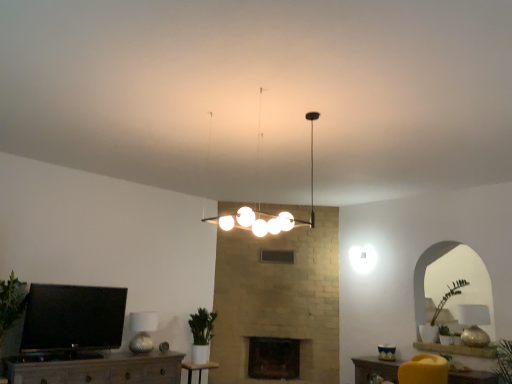
Find the location of `matte wood tv stand at lower left, positioned as the 1th furniture in left-to-right order`. matte wood tv stand at lower left, positioned as the 1th furniture in left-to-right order is located at coordinates (97, 368).

Find the location of a particular element. Image resolution: width=512 pixels, height=384 pixels. matte black tv at left is located at coordinates (72, 318).

Where is `metallic textured lampshade at lower left, acting as the 1th lamp starting from the left`? metallic textured lampshade at lower left, acting as the 1th lamp starting from the left is located at coordinates (142, 331).

What is the approximate height of velvet yellow armchair at lower right, which is the second furniture from left to right?

It is 15.23 inches.

Image resolution: width=512 pixels, height=384 pixels. What do you see at coordinates (474, 324) in the screenshot?
I see `gold textured lampshade at right, the second lamp when ordered from front to back` at bounding box center [474, 324].

Identify the location of wooden table at center, the first table from the left. (198, 369).

Where is `dark stone fireplace at center`? dark stone fireplace at center is located at coordinates (274, 358).

Which is in front, matte black tv at left or velvet yellow armchair at lower right, which appears as the first furniture when viewed from the right?

matte black tv at left is more forward.

Considering the sizes of objects matte black tv at left and velvet yellow armchair at lower right, which appears as the first furniture when viewed from the right, in the image provided, who is bigger, matte black tv at left or velvet yellow armchair at lower right, which appears as the first furniture when viewed from the right,?

velvet yellow armchair at lower right, which appears as the first furniture when viewed from the right, is bigger.

Is matte black tv at left oriented away from velvet yellow armchair at lower right, which appears as the first furniture when viewed from the right?

matte black tv at left is not turned away from velvet yellow armchair at lower right, which appears as the first furniture when viewed from the right.

What are the coordinates of `television above the velvet yellow armchair at lower right, which is the second furniture from left to right (from the image's perspective)` in the screenshot? It's located at (72, 318).

Which is less distant, [254,377] or [376,371]?

Point [254,377] is positioned farther from the camera compared to point [376,371].

Does dark stone fireplace at center have a greater width compared to matte wood table at lower center, which appears as the 1th table when viewed from the top?

Indeed, dark stone fireplace at center has a greater width compared to matte wood table at lower center, which appears as the 1th table when viewed from the top.

What's the angular difference between dark stone fireplace at center and matte wood table at lower center, which ranks as the second table in back-to-front order,'s facing directions?

The angle between the facing direction of dark stone fireplace at center and the facing direction of matte wood table at lower center, which ranks as the second table in back-to-front order, is 63.2 degrees.

From a real-world perspective, is dark stone fireplace at center physically below matte wood table at lower center, which is the 1th table from front to back?

Yes, from a real-world perspective, dark stone fireplace at center is beneath matte wood table at lower center, which is the 1th table from front to back.

Which of these two, velvet yellow armchair at lower right, which is the second furniture from left to right, or white glossy light fixture at center, the 1th lamp from the top, is wider?

white glossy light fixture at center, the 1th lamp from the top, is wider.

Is velvet yellow armchair at lower right, which is the second furniture from left to right, in front of or behind white glossy light fixture at center, the 1th lamp from the top, in the image?

Clearly, velvet yellow armchair at lower right, which is the second furniture from left to right, is behind white glossy light fixture at center, the 1th lamp from the top.

Is point (391, 366) positioned in front of point (259, 150)?

No, (391, 366) is behind (259, 150).

Looking at the image, does green matte plant at center seem bigger or smaller compared to matte wood table at lower center, the 2th table when ordered from left to right?

In the image, green matte plant at center appears to be larger than matte wood table at lower center, the 2th table when ordered from left to right.

Based on the photo, considering the sizes of objects green matte plant at center and matte wood table at lower center, the 2th table when ordered from left to right, in the image provided, who is shorter, green matte plant at center or matte wood table at lower center, the 2th table when ordered from left to right,?

Standing shorter between the two is matte wood table at lower center, the 2th table when ordered from left to right.

Is green matte plant at center placed right next to matte wood table at lower center, which appears as the 1th table when viewed from the top?

No.

Does green matte plant at center have a greater width compared to matte wood table at lower center, which is the 1th table from front to back?

Yes.

Is metallic textured lampshade at lower left, arranged as the third lamp when viewed from the front, inside velvet yellow armchair at lower right, which is the second furniture from left to right?

No, velvet yellow armchair at lower right, which is the second furniture from left to right, does not contain metallic textured lampshade at lower left, arranged as the third lamp when viewed from the front.

From the image's perspective, is velvet yellow armchair at lower right, which is the second furniture from left to right, above or below metallic textured lampshade at lower left, which is the 1th lamp in bottom-to-top order?

velvet yellow armchair at lower right, which is the second furniture from left to right, is situated lower than metallic textured lampshade at lower left, which is the 1th lamp in bottom-to-top order, in the image.

Considering the points (448, 381) and (143, 320), which point is behind, point (448, 381) or point (143, 320)?

Positioned behind is point (143, 320).

The height and width of the screenshot is (384, 512). I want to click on the 1st furniture in front of the metallic textured lampshade at lower left, the third lamp when ordered from right to left, so click(375, 369).

Which of these two, green matte plant at center or gold textured lampshade at right, the second lamp when ordered from front to back, is bigger?

green matte plant at center.

Based on the photo, considering the sizes of green matte plant at center and gold textured lampshade at right, marked as the 2th lamp in a top-to-bottom arrangement, in the image, is green matte plant at center wider or thinner than gold textured lampshade at right, marked as the 2th lamp in a top-to-bottom arrangement,?

Clearly, green matte plant at center has more width compared to gold textured lampshade at right, marked as the 2th lamp in a top-to-bottom arrangement.

How many degrees apart are the facing directions of green matte plant at center and gold textured lampshade at right, which appears as the 1th lamp when viewed from the right?

The facing directions of green matte plant at center and gold textured lampshade at right, which appears as the 1th lamp when viewed from the right, are 1.04 degrees apart.

Is gold textured lampshade at right, which appears as the second lamp when ordered from the bottom, completely or partially inside green matte plant at center?

No, green matte plant at center does not contain gold textured lampshade at right, which appears as the second lamp when ordered from the bottom.

Is matte black tv at left turned away from matte wood table at lower center, which appears as the 1th table when viewed from the top?

No.

Considering the relative sizes of matte black tv at left and matte wood table at lower center, which ranks as the second table in back-to-front order, in the image provided, is matte black tv at left smaller than matte wood table at lower center, which ranks as the second table in back-to-front order,?

Actually, matte black tv at left might be larger than matte wood table at lower center, which ranks as the second table in back-to-front order.

Which is further, (100, 302) or (396, 377)?

The point (396, 377) is more distant.

Considering the relative sizes of matte black tv at left and matte wood table at lower center, the 2th table when ordered from left to right, in the image provided, is matte black tv at left shorter than matte wood table at lower center, the 2th table when ordered from left to right,?

Incorrect, the height of matte black tv at left does not fall short of that of matte wood table at lower center, the 2th table when ordered from left to right.

You are a GUI agent. You are given a task and a screenshot of the screen. Output one action in this format:
    pyautogui.click(x=<x>, y=<y>)
    Task: Click on the furniture behind the matte black tv at left
    
    Given the screenshot: What is the action you would take?
    pyautogui.click(x=375, y=369)

Identify the location of fireplace that is on the left side of matte wood table at lower center, which appears as the 1th table when viewed from the top. (274, 358).

Which object lies further to the anchor point matte wood table at lower center, placed as the second table when sorted from bottom to top, green matte plant at center or matte wood tv stand at lower left, positioned as the 1th furniture in left-to-right order?

matte wood tv stand at lower left, positioned as the 1th furniture in left-to-right order.

Considering their positions, is green matte plant at center positioned closer to matte wood tv stand at lower left, positioned as the 1th furniture in left-to-right order, than white glossy light fixture at center, the 1th lamp from the top?

Among the two, green matte plant at center is located nearer to matte wood tv stand at lower left, positioned as the 1th furniture in left-to-right order.

Considering their positions, is matte black tv at left positioned closer to velvet yellow armchair at lower right, which is the second furniture from left to right, than gold textured lampshade at right, which appears as the second lamp when ordered from the bottom?

gold textured lampshade at right, which appears as the second lamp when ordered from the bottom.

Estimate the real-world distances between objects in this image. Which object is further from matte wood table at lower center, placed as the second table when sorted from bottom to top, white glossy light fixture at center, marked as the 2th lamp in a left-to-right arrangement, or matte wood tv stand at lower left, the 2th furniture viewed from the right?

Based on the image, matte wood tv stand at lower left, the 2th furniture viewed from the right, appears to be further to matte wood table at lower center, placed as the second table when sorted from bottom to top.

Based on their spatial positions, is matte wood tv stand at lower left, positioned as the 1th furniture in left-to-right order, or wooden table at center, marked as the 2th table in a right-to-left arrangement, closer to green matte plant at center?

Based on the image, wooden table at center, marked as the 2th table in a right-to-left arrangement, appears to be nearer to green matte plant at center.

Based on their spatial positions, is matte wood tv stand at lower left, the 2th furniture viewed from the right, or dark stone fireplace at center further from metallic textured lampshade at lower left, acting as the 1th lamp starting from the left?

Based on the image, dark stone fireplace at center appears to be further to metallic textured lampshade at lower left, acting as the 1th lamp starting from the left.

When comparing their distances from metallic textured lampshade at lower left, placed as the first lamp when sorted from back to front, does matte black tv at left or gold textured lampshade at right, which appears as the 1th lamp when viewed from the right, seem further?

Based on the image, gold textured lampshade at right, which appears as the 1th lamp when viewed from the right, appears to be further to metallic textured lampshade at lower left, placed as the first lamp when sorted from back to front.

From the image, which object appears to be farther from white glossy light fixture at center, the 2th lamp in the right-to-left sequence, metallic textured lampshade at lower left, which appears as the 3th lamp when viewed from the top, or matte wood tv stand at lower left, the 2th furniture viewed from the right?

metallic textured lampshade at lower left, which appears as the 3th lamp when viewed from the top.

The width and height of the screenshot is (512, 384). Find the location of `table between metallic textured lampshade at lower left, the third lamp when ordered from right to left, and green matte plant at center`. table between metallic textured lampshade at lower left, the third lamp when ordered from right to left, and green matte plant at center is located at coordinates (198, 369).

Where is `plant situated between wooden table at center, marked as the 2th table in a right-to-left arrangement, and dark stone fireplace at center from left to right`? This screenshot has height=384, width=512. plant situated between wooden table at center, marked as the 2th table in a right-to-left arrangement, and dark stone fireplace at center from left to right is located at coordinates (202, 326).

You are a GUI agent. You are given a task and a screenshot of the screen. Output one action in this format:
    pyautogui.click(x=<x>, y=<y>)
    Task: Click on the television between white glossy light fixture at center, which is the third lamp in bottom-to-top order, and green matte plant at center from front to back
    
    Given the screenshot: What is the action you would take?
    pyautogui.click(x=72, y=318)

At what (x,y) coordinates should I click in order to perform the action: click on plant between metallic textured lampshade at lower left, the third lamp when ordered from right to left, and gold textured lampshade at right, which appears as the second lamp when ordered from the bottom. Please return your answer as a coordinate pair (x, y). The height and width of the screenshot is (384, 512). Looking at the image, I should click on (202, 326).